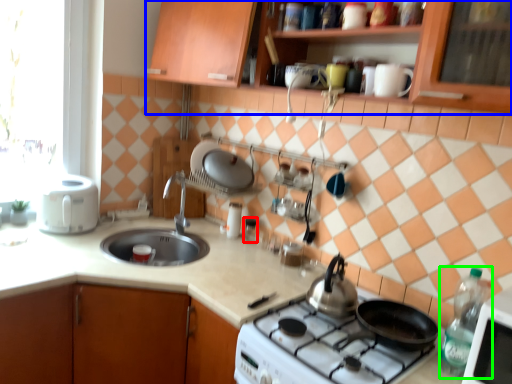
Question: Based on their relative distances, which object is farther from appliance (highlighted by a red box)? Choose from cabinetry (highlighted by a blue box) and kitchen appliance (highlighted by a green box).

Choices:
 (A) cabinetry
 (B) kitchen appliance

Answer: (B)